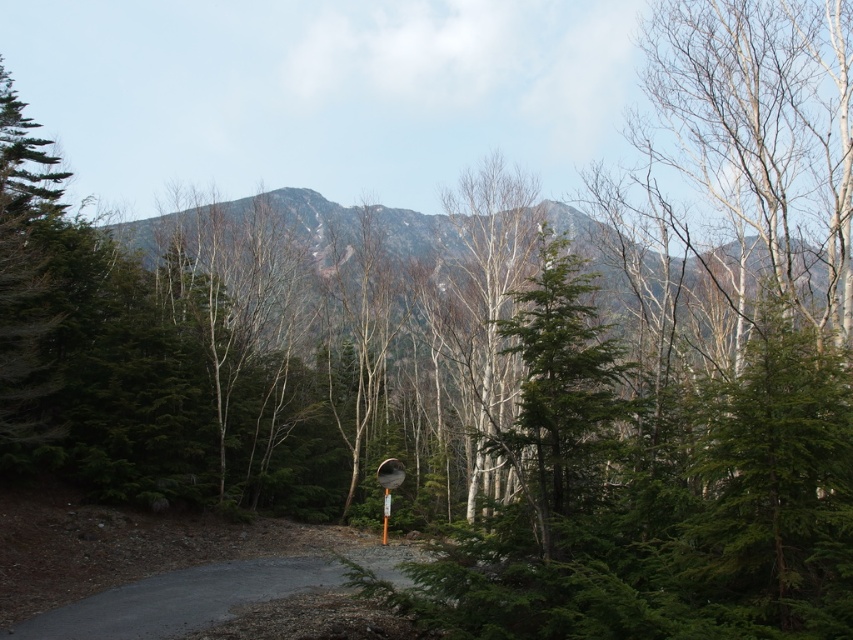
Question: Can you confirm if gray asphalt road at center is positioned above bare wood tree at center?

Choices:
 (A) no
 (B) yes

Answer: (A)

Question: Which is nearer to the gray rocky mountain at center?

Choices:
 (A) gray asphalt road at center
 (B) green matte tree at center

Answer: (B)

Question: Among these objects, which one is farthest from the camera?

Choices:
 (A) gray rocky mountain at center
 (B) gray asphalt road at center
 (C) green matte tree at center

Answer: (B)

Question: Does gray rocky mountain at center have a greater width compared to bare wood tree at center?

Choices:
 (A) yes
 (B) no

Answer: (A)

Question: Which of the following is the farthest from the observer?

Choices:
 (A) gray rocky mountain at center
 (B) green matte tree at center
 (C) bare wood tree at center

Answer: (C)

Question: Is gray rocky mountain at center bigger than bare wood tree at center?

Choices:
 (A) yes
 (B) no

Answer: (A)